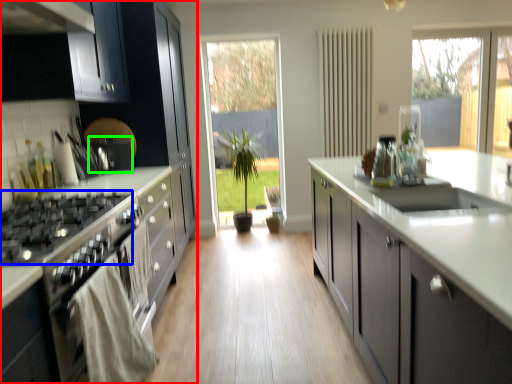
Question: Considering the real-world distances, which object is farthest from cabinetry (highlighted by a red box)? gas stove (highlighted by a blue box) or appliance (highlighted by a green box)?

Choices:
 (A) gas stove
 (B) appliance

Answer: (A)